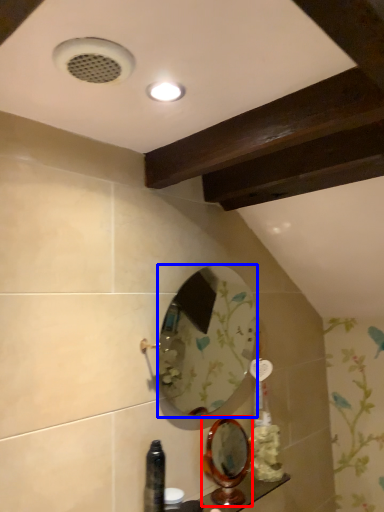
Question: Which point is further to the camera, mirror (highlighted by a red box) or mirror (highlighted by a blue box)?

Choices:
 (A) mirror
 (B) mirror

Answer: (A)